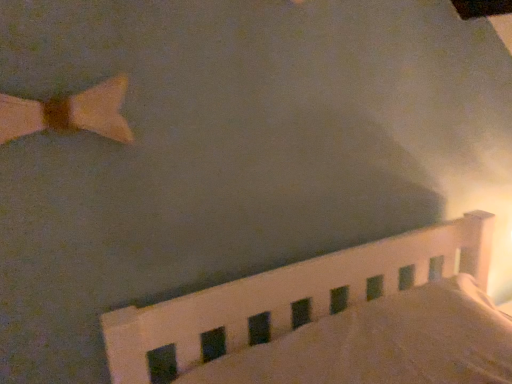
Where is `blank space situated above white matte bed at lower right (from a real-world perspective)`? The image size is (512, 384). blank space situated above white matte bed at lower right (from a real-world perspective) is located at coordinates (376, 335).